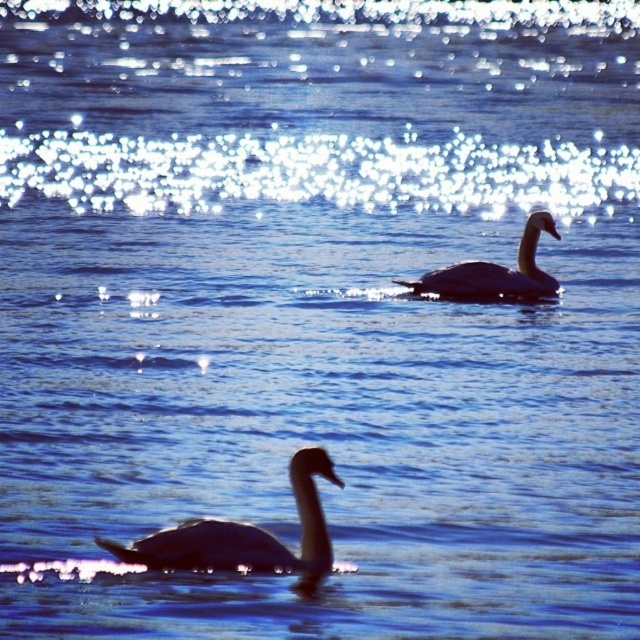
Between silvery glossy swan at lower left and gray matte swan at upper right, which one appears on the left side from the viewer's perspective?

From the viewer's perspective, silvery glossy swan at lower left appears more on the left side.

Does silvery glossy swan at lower left appear on the right side of gray matte swan at upper right?

No, silvery glossy swan at lower left is not to the right of gray matte swan at upper right.

Find the location of a particular element. silvery glossy swan at lower left is located at coordinates (244, 534).